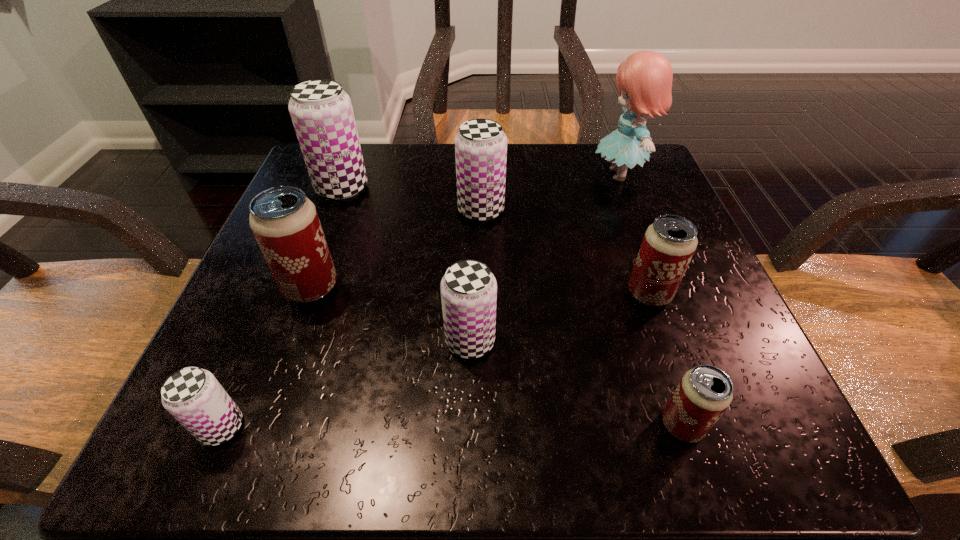
Find the location of a particular element. blue doll is located at coordinates click(x=644, y=79).

This screenshot has height=540, width=960. Find the location of `the tallest object`. the tallest object is located at coordinates (644, 79).

Identify the location of the second tallest object. (321, 111).

Find the location of `the tallest beer can`. the tallest beer can is located at coordinates (321, 111).

You are a GUI agent. You are given a task and a screenshot of the screen. Output one action in this format:
    pyautogui.click(x=<x>, y=<y>)
    Task: Click on the third smallest purple beer can
    The width and height of the screenshot is (960, 540).
    Given the screenshot: What is the action you would take?
    pyautogui.click(x=480, y=145)

Locate an element on the screen. This screenshot has height=540, width=960. the leftmost red beer can is located at coordinates (285, 223).

Locate an element on the screen. Image resolution: width=960 pixels, height=540 pixels. the second biggest red beer can is located at coordinates (669, 243).

What are the coordinates of `the second smallest purple beer can` in the screenshot? It's located at (468, 289).

This screenshot has width=960, height=540. Find the location of `the fifth farthest beer can`. the fifth farthest beer can is located at coordinates (468, 289).

In order to click on the nearest purple beer can in this screenshot , I will do `click(193, 396)`.